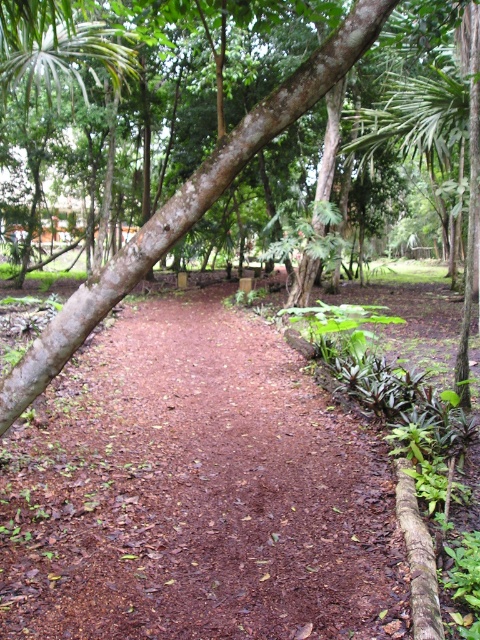
You are a hiker trying to cross the brown dirt trail at center. There is a brown rough tree at center blocking your path. Can you walk over it or do you need to go around?

The brown dirt trail at center is much taller than the brown rough tree at center, so you can walk over it easily.

You are standing at the point closer to the camera in the scene. Which point are you at, point (207, 490) or point (128, 272)?

You are at point (128, 272) because it is closer to the camera compared to point (207, 490).

You are a hiker walking along the brown dirt trail at center and want to take a photo of the brown rough tree at center. Which side of the trail should you stand on to get the best view of the tree?

The brown dirt trail at center is positioned on the left side of brown rough tree at center, so you should stand on the right side of the trail to get the best view of the tree.